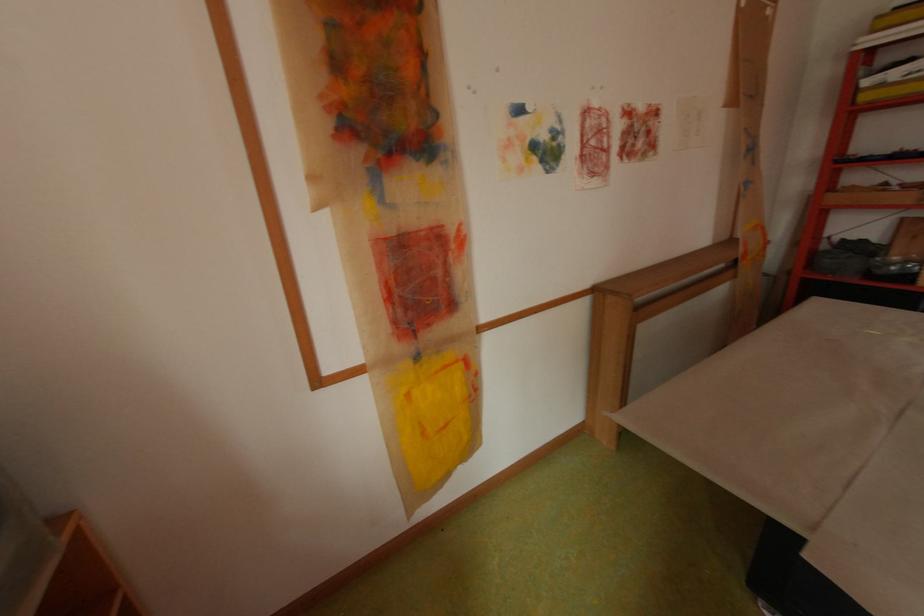
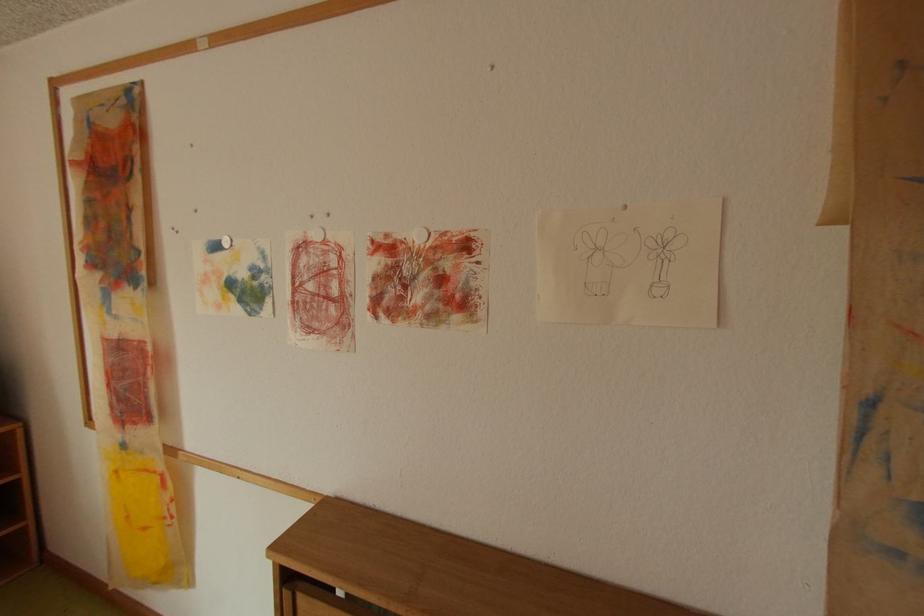
Find the pixel in the second image that matches pixel 549 168 in the first image.

(247, 309)